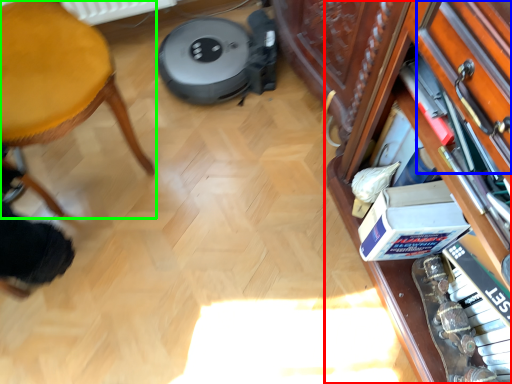
Question: Estimate the real-world distances between objects in this image. Which object is farther from shelf (highlighted by a red box), drawer (highlighted by a blue box) or furniture (highlighted by a green box)?

Choices:
 (A) drawer
 (B) furniture

Answer: (B)